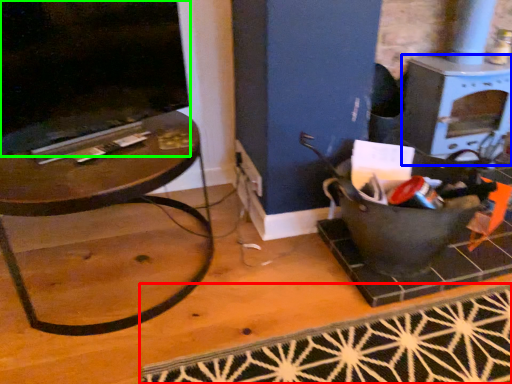
Question: Which object is positioned closest to doormat (highlighted by a red box)? Select from stove (highlighted by a blue box) and fireplace (highlighted by a green box).

Choices:
 (A) stove
 (B) fireplace

Answer: (A)